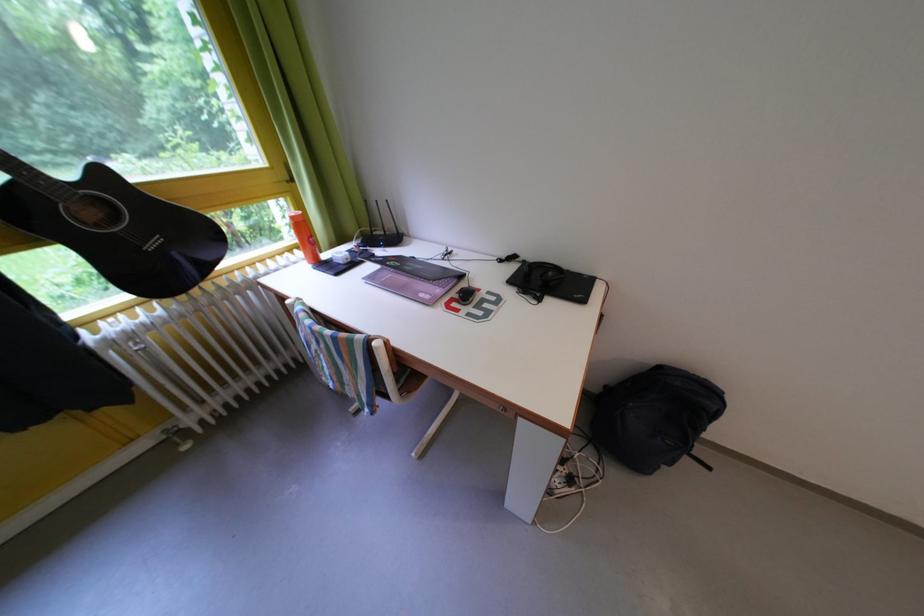
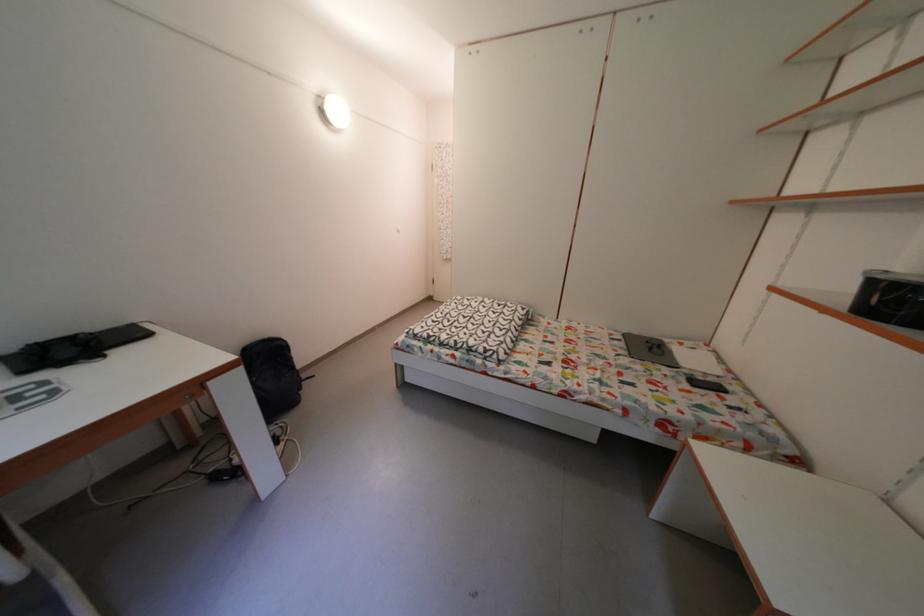
Locate, in the second image, the point that corresponds to the point at 533,267 in the first image.

(6, 363)